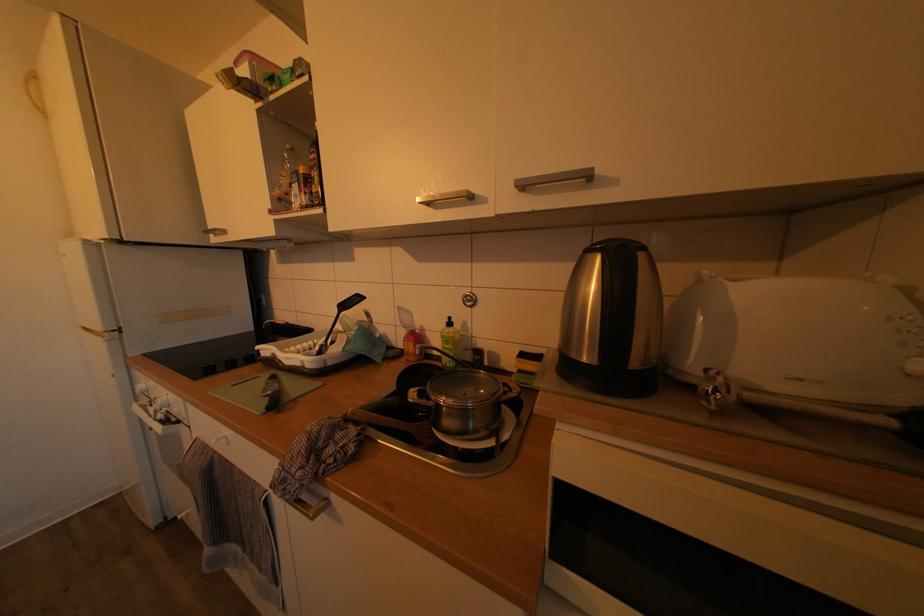
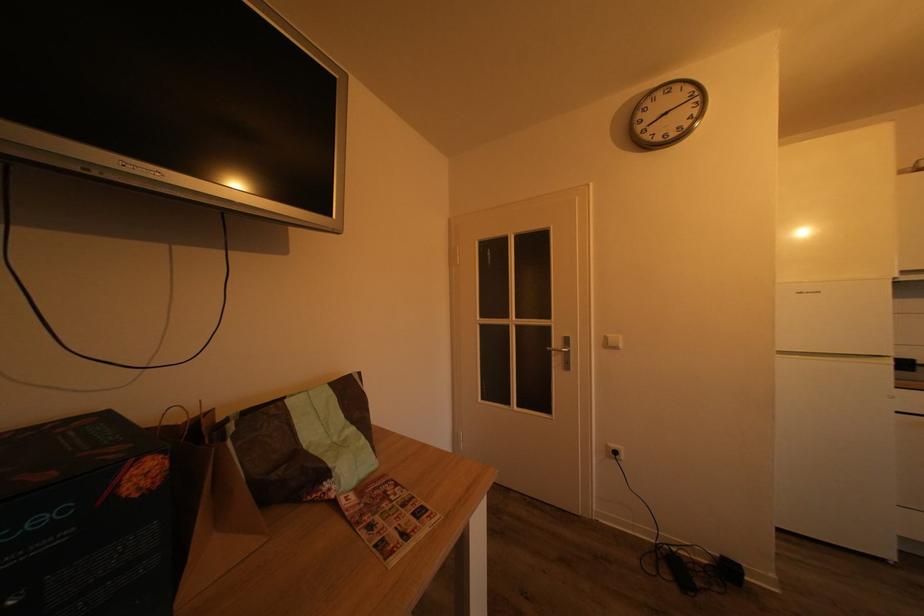
Question: The images are taken continuously from a first-person perspective. In which direction are you moving?

Choices:
 (A) Left
 (B) Right
 (C) Forward
 (D) Backward

Answer: (A)